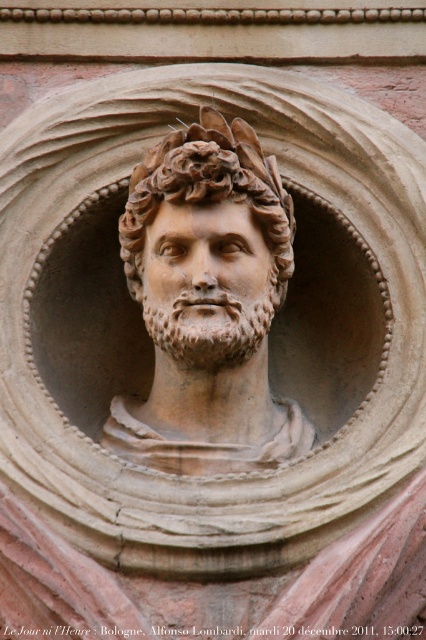
Question: Can you confirm if matte stone bust at center is smaller than rough stone face at center?

Choices:
 (A) no
 (B) yes

Answer: (A)

Question: Which point appears closest to the camera in this image?

Choices:
 (A) (213, 301)
 (B) (204, 237)

Answer: (A)

Question: Which object is closer to the camera taking this photo?

Choices:
 (A) rough stone face at center
 (B) matte stone bust at center

Answer: (B)

Question: Can you confirm if matte stone bust at center is positioned to the left of rough stone face at center?

Choices:
 (A) no
 (B) yes

Answer: (A)

Question: Is matte stone bust at center smaller than rough stone face at center?

Choices:
 (A) no
 (B) yes

Answer: (A)